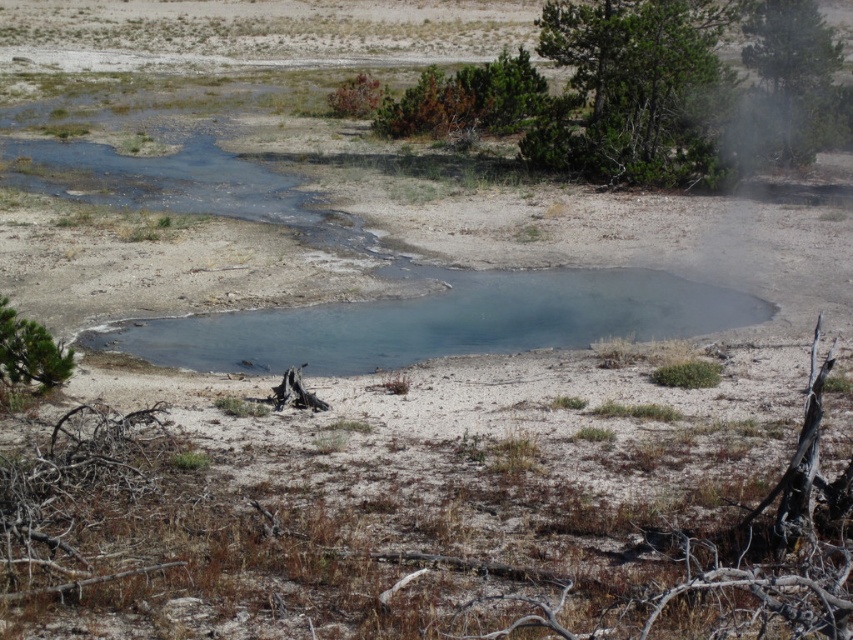
You are planning to plant a new tree in this landscape. The new tree requires a minimum of 20 meters of space between it and any existing trees to thrive. Given the current spacing between the green leafy tree at upper right and the green matte tree at lower left, is this area suitable for planting the new tree without violating the spacing requirement?

The green leafy tree at upper right and the green matte tree at lower left are 20.51 meters apart. Since the required minimum spacing is 20 meters, the existing trees already meet the requirement. Therefore, this area is suitable for planting the new tree as long as it is placed at least 20 meters away from both existing trees.

You are standing in the middle of the sandy area and want to walk towards the green leafy tree at upper right. Which direction should you walk to avoid passing by the green textured tree at upper right?

To reach the green leafy tree at upper right without passing by the green textured tree at upper right, you should walk directly towards the green leafy tree at upper right since the green textured tree at upper right is positioned to its left side, so moving towards the right side of the green leafy tree at upper right would avoid the other tree.

You are standing at the edge of the shallow water and want to determine which tree is closer to you between the green textured tree at upper right and the green leafy tree at upper right. Based on their heights, can you figure out which one is nearer?

The green textured tree at upper right is not as tall as the green leafy tree at upper right, so the shorter green textured tree at upper right is closer to you.